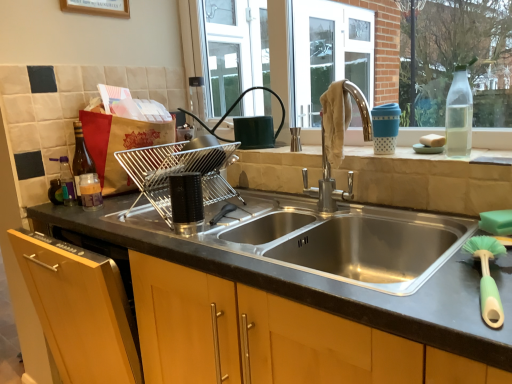
Identify the location of vacant area that is in front of black plastic dish rack at center, marked as the second appliance in a back-to-front arrangement. This screenshot has height=384, width=512. (184, 241).